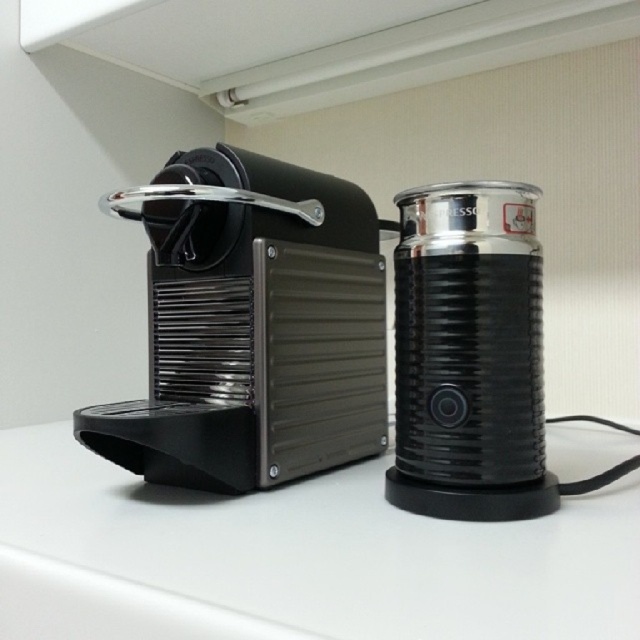
Is matte black coffee machine at left smaller than black textured milk frother at right?

Actually, matte black coffee machine at left might be larger than black textured milk frother at right.

This screenshot has height=640, width=640. What do you see at coordinates (252, 326) in the screenshot?
I see `matte black coffee machine at left` at bounding box center [252, 326].

Which is behind, point (324, 292) or point (500, 250)?

Point (324, 292)

What are the coordinates of `matte black coffee machine at left` in the screenshot? It's located at (252, 326).

Who is lower down, white matte counter at center or black textured milk frother at right?

Positioned lower is white matte counter at center.

Based on the photo, does white matte counter at center come behind black textured milk frother at right?

No, it is in front of black textured milk frother at right.

Is point (552, 625) farther from viewer compared to point (426, 451)?

No, it is in front of (426, 451).

Identify the location of white matte counter at center. The height and width of the screenshot is (640, 640). (294, 557).

Can you confirm if white matte counter at center is wider than matte black coffee machine at left?

Yes, white matte counter at center is wider than matte black coffee machine at left.

Is white matte counter at center below matte black coffee machine at left?

Indeed, white matte counter at center is positioned under matte black coffee machine at left.

What do you see at coordinates (294, 557) in the screenshot?
I see `white matte counter at center` at bounding box center [294, 557].

Find the location of a particular element. The width and height of the screenshot is (640, 640). white matte counter at center is located at coordinates (294, 557).